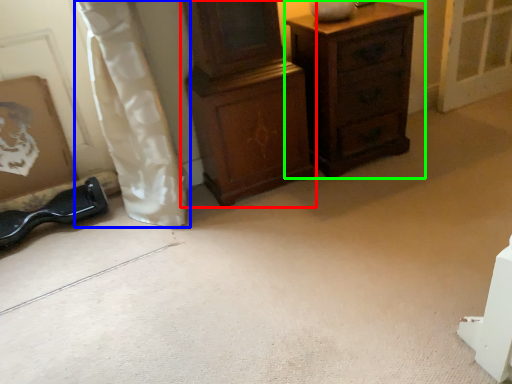
Question: Which object is positioned closest to chest of drawers (highlighted by a red box)? Select from curtain (highlighted by a blue box) and chest of drawers (highlighted by a green box).

Choices:
 (A) curtain
 (B) chest of drawers

Answer: (B)